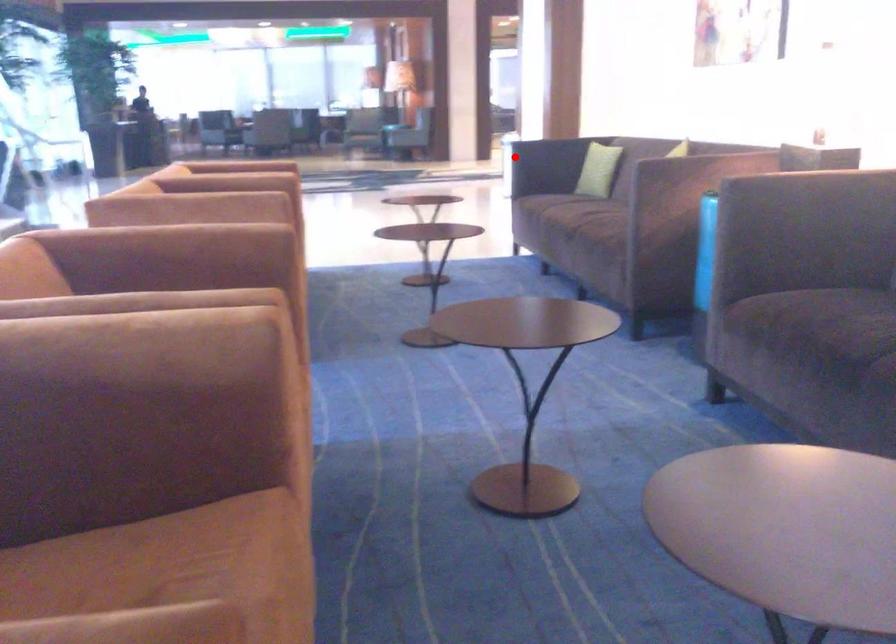
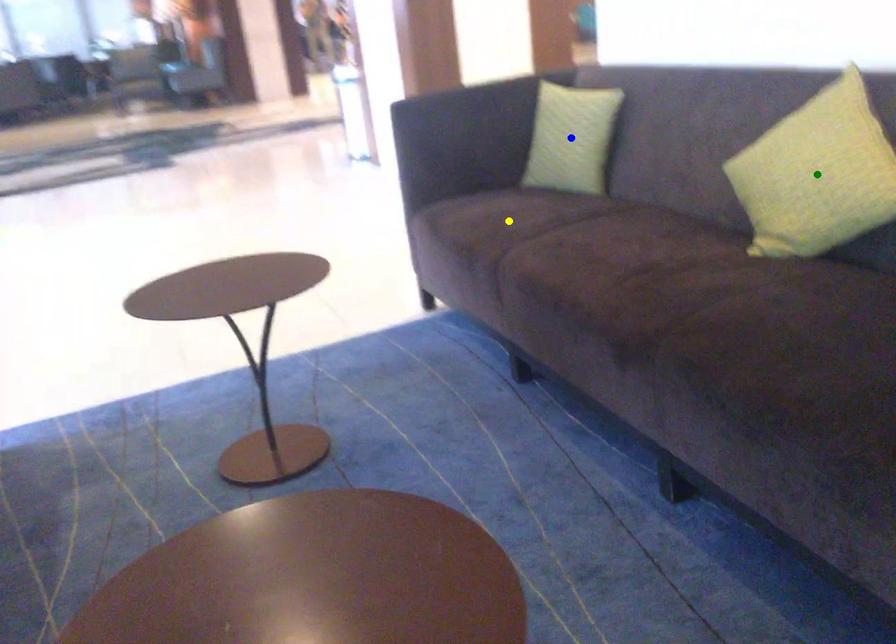
Question: I am providing you with two images of the same scene from different viewpoints. A red point is marked on the first image. You are given multiple points on the second image. Which spot in image 2 lines up with the point in image 1?

Choices:
 (A) yellow point
 (B) green point
 (C) blue point

Answer: (A)